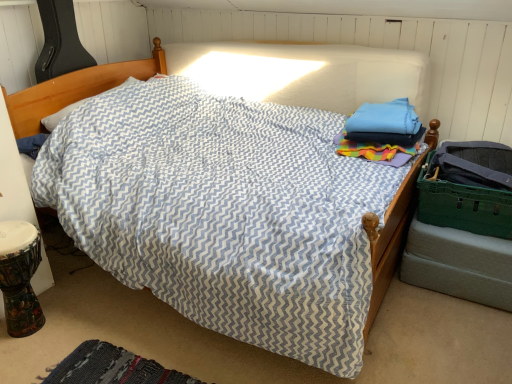
The image size is (512, 384). Find the location of `woven fabric mat at lower left`. woven fabric mat at lower left is located at coordinates (111, 368).

Describe the element at coordinates (111, 368) in the screenshot. I see `woven fabric mat at lower left` at that location.

Where is `green plastic laundry basket at right`? The height and width of the screenshot is (384, 512). green plastic laundry basket at right is located at coordinates (463, 206).

What do you see at coordinates (463, 206) in the screenshot? I see `green plastic laundry basket at right` at bounding box center [463, 206].

The width and height of the screenshot is (512, 384). I want to click on woven fabric mat at lower left, so click(x=111, y=368).

Would you say green plastic laundry basket at right is to the left or to the right of woven fabric mat at lower left in the picture?

Clearly, green plastic laundry basket at right is on the right of woven fabric mat at lower left in the image.

Is green plastic laundry basket at right closer to camera compared to woven fabric mat at lower left?

No, green plastic laundry basket at right is further to the viewer.

Which is closer, (502, 232) or (124, 370)?

Point (502, 232) appears to be farther away from the viewer than point (124, 370).

From the image's perspective, would you say green plastic laundry basket at right is positioned over woven fabric mat at lower left?

Yes, from the image's perspective, green plastic laundry basket at right is over woven fabric mat at lower left.

From a real-world perspective, which object rests below the other?

From a 3D spatial view, woven fabric mat at lower left is below.

Considering the sizes of objects green plastic laundry basket at right and woven fabric mat at lower left in the image provided, who is thinner, green plastic laundry basket at right or woven fabric mat at lower left?

With smaller width is green plastic laundry basket at right.

Does green plastic laundry basket at right have a lesser height compared to woven fabric mat at lower left?

No, green plastic laundry basket at right is not shorter than woven fabric mat at lower left.

Considering the sizes of objects green plastic laundry basket at right and woven fabric mat at lower left in the image provided, who is smaller, green plastic laundry basket at right or woven fabric mat at lower left?

With smaller size is woven fabric mat at lower left.

Is green plastic laundry basket at right inside or outside of woven fabric mat at lower left?

green plastic laundry basket at right exists outside the volume of woven fabric mat at lower left.

Would you consider green plastic laundry basket at right to be distant from woven fabric mat at lower left?

That's right, there is a large distance between green plastic laundry basket at right and woven fabric mat at lower left.

Is green plastic laundry basket at right looking in the opposite direction of woven fabric mat at lower left?

No, green plastic laundry basket at right is not facing the opposite direction of woven fabric mat at lower left.

Locate an element on the screen. mat on the left side of green plastic laundry basket at right is located at coordinates (111, 368).

Can you confirm if woven fabric mat at lower left is positioned to the right of green plastic laundry basket at right?

No, woven fabric mat at lower left is not to the right of green plastic laundry basket at right.

Is woven fabric mat at lower left in front of or behind green plastic laundry basket at right in the image?

Clearly, woven fabric mat at lower left is in front of green plastic laundry basket at right.

Does point (93, 370) appear closer or farther from the camera than point (504, 193)?

Point (93, 370) is positioned closer to the camera compared to point (504, 193).

From the image's perspective, is woven fabric mat at lower left positioned above or below green plastic laundry basket at right?

woven fabric mat at lower left is below green plastic laundry basket at right.

From a real-world perspective, who is located lower, woven fabric mat at lower left or green plastic laundry basket at right?

woven fabric mat at lower left.

Between woven fabric mat at lower left and green plastic laundry basket at right, which one has smaller width?

green plastic laundry basket at right is thinner.

Consider the image. Considering the sizes of objects woven fabric mat at lower left and green plastic laundry basket at right in the image provided, who is taller, woven fabric mat at lower left or green plastic laundry basket at right?

Standing taller between the two is green plastic laundry basket at right.

Who is bigger, woven fabric mat at lower left or green plastic laundry basket at right?

green plastic laundry basket at right.

Is woven fabric mat at lower left located outside green plastic laundry basket at right?

Yes, woven fabric mat at lower left is not within green plastic laundry basket at right.

Are woven fabric mat at lower left and green plastic laundry basket at right making contact?

No, woven fabric mat at lower left is not with green plastic laundry basket at right.

Is woven fabric mat at lower left oriented towards green plastic laundry basket at right?

No, woven fabric mat at lower left is not aimed at green plastic laundry basket at right.

How many degrees apart are the facing directions of woven fabric mat at lower left and green plastic laundry basket at right?

The facing directions of woven fabric mat at lower left and green plastic laundry basket at right are 95.8 degrees apart.

You are a GUI agent. You are given a task and a screenshot of the screen. Output one action in this format:
    pyautogui.click(x=<x>, y=<y>)
    Task: Click on the laundry basket above the woven fabric mat at lower left (from a real-world perspective)
    This screenshot has height=384, width=512.
    Given the screenshot: What is the action you would take?
    pyautogui.click(x=463, y=206)

Find the location of a particular element. Image resolution: width=512 pixels, height=384 pixels. laundry basket above the woven fabric mat at lower left (from a real-world perspective) is located at coordinates (463, 206).

I want to click on mat that appears in front of the green plastic laundry basket at right, so click(x=111, y=368).